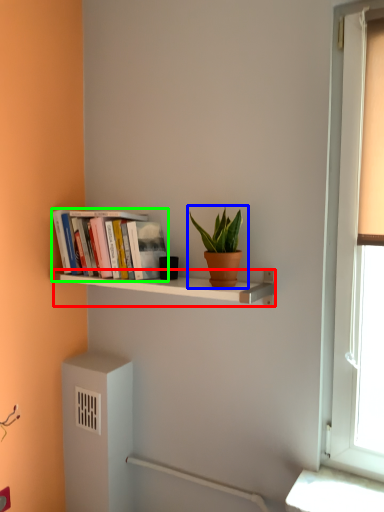
Question: Considering the real-world distances, which object is closest to shelf (highlighted by a red box)? houseplant (highlighted by a blue box) or book (highlighted by a green box).

Choices:
 (A) houseplant
 (B) book

Answer: (B)